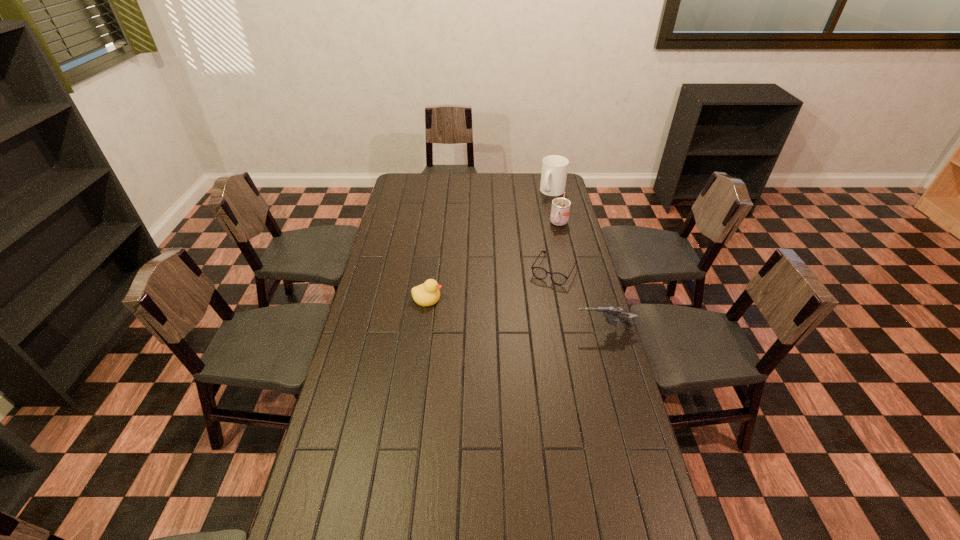
The width and height of the screenshot is (960, 540). Identify the location of vacant region located 0.280m on the face of the duckling. (515, 298).

Find the location of a particular element. This screenshot has height=540, width=960. vacant area situated 0.230m at the barrel of the third shortest object is located at coordinates (512, 329).

Where is `vacant space located at the barrel of the third shortest object`? vacant space located at the barrel of the third shortest object is located at coordinates (525, 329).

At what (x,y) coordinates should I click in order to perform the action: click on free space located at the barrel of the third shortest object. Please return your answer as a coordinate pair (x, y). Looking at the image, I should click on (494, 329).

Identify the location of vacant space positioned 0.320m on the front-facing side of the shortest object. The height and width of the screenshot is (540, 960). (516, 340).

Where is `free region located on the front-facing side of the shortest object`? Image resolution: width=960 pixels, height=540 pixels. free region located on the front-facing side of the shortest object is located at coordinates (508, 356).

You are a GUI agent. You are given a task and a screenshot of the screen. Output one action in this format:
    pyautogui.click(x=<x>, y=<y>)
    Task: Click on the vacant space located 0.290m on the front-facing side of the shortest object
    
    Given the screenshot: What is the action you would take?
    [x=519, y=334]

Identify the location of blank area located on the side with the handle of the fourth nearest object. (537, 270).

Where is `vacant region located on the side with the handle of the fourth nearest object`? vacant region located on the side with the handle of the fourth nearest object is located at coordinates click(x=546, y=253).

Find the location of `free space located on the side with the handle of the fourth nearest object`. free space located on the side with the handle of the fourth nearest object is located at coordinates (546, 251).